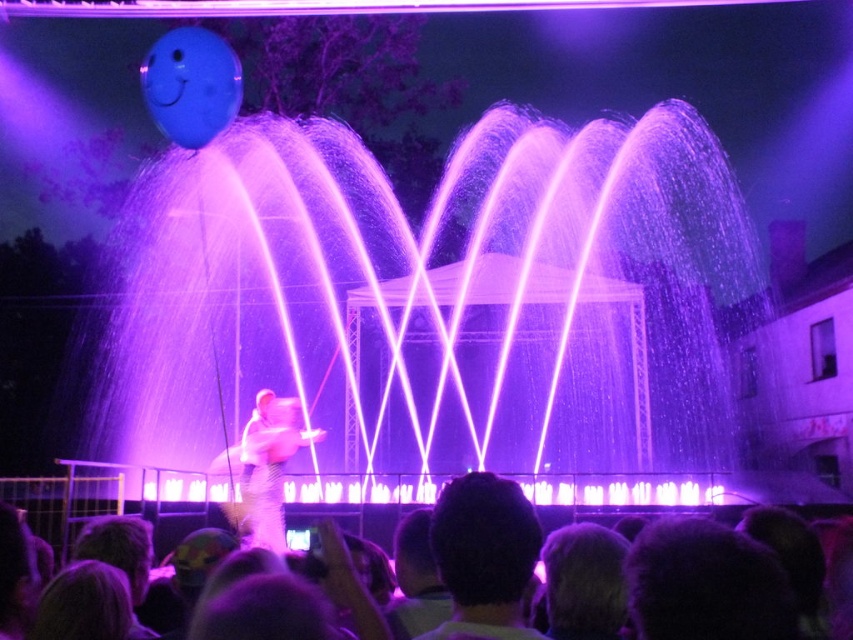
Between purple translucent water at center and white fluffy costume at center, which one appears on the left side from the viewer's perspective?

white fluffy costume at center

At what (x,y) coordinates should I click in order to perform the action: click on purple translucent water at center. Please return your answer as a coordinate pair (x, y). Image resolution: width=853 pixels, height=640 pixels. Looking at the image, I should click on (442, 298).

Who is more forward, (682, 362) or (291, 404)?

Point (291, 404)

Find the location of a particular element. The width and height of the screenshot is (853, 640). purple translucent water at center is located at coordinates click(442, 298).

Is purple translucent water at center below silky hair at lower center?

Incorrect, purple translucent water at center is not positioned below silky hair at lower center.

Which is in front, point (271, 262) or point (421, 493)?

Positioned in front is point (421, 493).

What do you see at coordinates (442, 298) in the screenshot? I see `purple translucent water at center` at bounding box center [442, 298].

Where is `purple translucent water at center`? The width and height of the screenshot is (853, 640). purple translucent water at center is located at coordinates (442, 298).

Locate an element on the screen. This screenshot has width=853, height=640. silky hair at lower center is located at coordinates (90, 506).